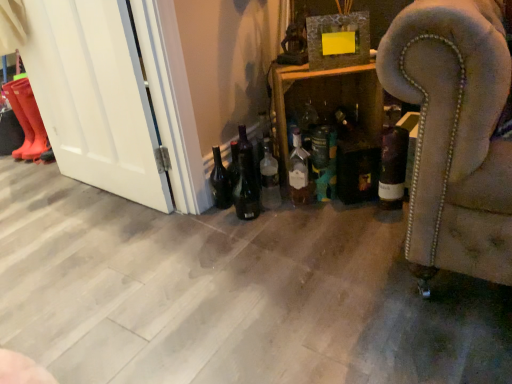
Question: Is matte glass bottle at center, which is counted as the 4th bottle, starting from the right, aimed at dark glass bottle at center-right, which ranks as the fifth bottle in left-to-right order?

Choices:
 (A) no
 (B) yes

Answer: (A)

Question: Does matte glass bottle at center, which appears as the 2th bottle when viewed from the left, have a greater width compared to dark glass bottle at center-right, which ranks as the fifth bottle in left-to-right order?

Choices:
 (A) yes
 (B) no

Answer: (B)

Question: Can you confirm if matte glass bottle at center, which is counted as the 4th bottle, starting from the right, is smaller than dark glass bottle at center-right, the 1th bottle positioned from the right?

Choices:
 (A) no
 (B) yes

Answer: (B)

Question: From the image's perspective, is matte glass bottle at center, which appears as the 2th bottle when viewed from the left, on top of dark glass bottle at center-right, which ranks as the fifth bottle in left-to-right order?

Choices:
 (A) no
 (B) yes

Answer: (B)

Question: From the image's perspective, is matte glass bottle at center, which is counted as the 4th bottle, starting from the right, located beneath dark glass bottle at center-right, which ranks as the fifth bottle in left-to-right order?

Choices:
 (A) no
 (B) yes

Answer: (A)

Question: Is matte glass bottle at center, which is counted as the 4th bottle, starting from the right, positioned beyond the bounds of dark glass bottle at center-right, which ranks as the fifth bottle in left-to-right order?

Choices:
 (A) no
 (B) yes

Answer: (B)

Question: Considering the relative sizes of matte glass bottle at lower left, the 1th beer bottle from the left, and matte glass bottle at center, which appears as the 2th bottle when viewed from the left, in the image provided, is matte glass bottle at lower left, the 1th beer bottle from the left, smaller than matte glass bottle at center, which appears as the 2th bottle when viewed from the left,?

Choices:
 (A) no
 (B) yes

Answer: (A)

Question: From the image's perspective, does matte glass bottle at lower left, placed as the 2th beer bottle when sorted from right to left, appear higher than matte glass bottle at center, which appears as the 2th bottle when viewed from the left?

Choices:
 (A) no
 (B) yes

Answer: (A)

Question: Is matte glass bottle at lower left, placed as the 2th beer bottle when sorted from right to left, taller than matte glass bottle at center, which appears as the 2th bottle when viewed from the left?

Choices:
 (A) no
 (B) yes

Answer: (A)

Question: Is matte glass bottle at lower left, placed as the 2th beer bottle when sorted from right to left, oriented away from matte glass bottle at center, which appears as the 2th bottle when viewed from the left?

Choices:
 (A) no
 (B) yes

Answer: (A)

Question: Is matte glass bottle at lower left, the 1th beer bottle from the left, placed right next to matte glass bottle at center, which appears as the 2th bottle when viewed from the left?

Choices:
 (A) no
 (B) yes

Answer: (A)

Question: Is matte glass bottle at lower left, the 1th beer bottle from the left, outside matte glass bottle at center, which appears as the 2th bottle when viewed from the left?

Choices:
 (A) no
 (B) yes

Answer: (B)

Question: Is matte glass bottle at lower left, placed as the 2th beer bottle when sorted from right to left, closer to the viewer compared to rubber boots at left, the 2th boot viewed from the right?

Choices:
 (A) no
 (B) yes

Answer: (B)